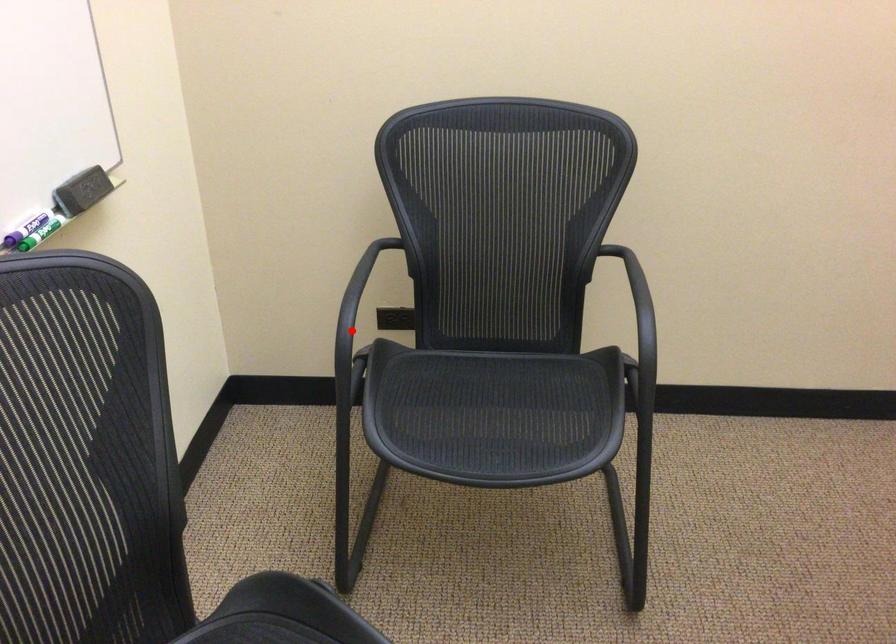
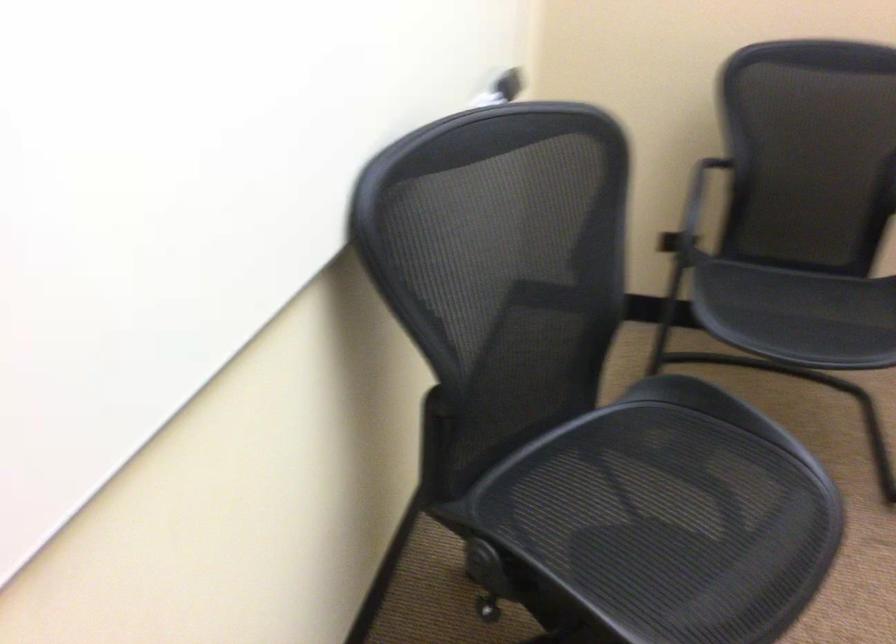
Where in the second image is the point corresponding to the highlighted location from the first image?

(692, 212)